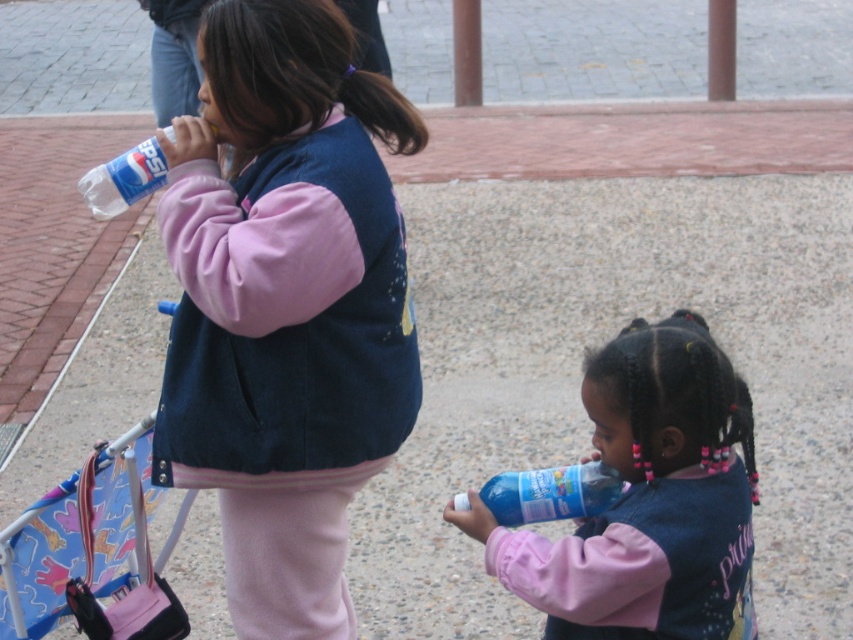
Question: Is blue translucent bottle at lower center above white plastic bottle at upper left?

Choices:
 (A) no
 (B) yes

Answer: (A)

Question: Among these objects, which one is farthest from the camera?

Choices:
 (A) multicolored fabric baby carriage at left
 (B) matte blue vest at center

Answer: (A)

Question: Considering the real-world distances, which object is farthest from the blue translucent bottle at lower center?

Choices:
 (A) matte blue vest at center
 (B) blue plastic bottle at center

Answer: (A)

Question: Among these points, which one is farthest from the camera?

Choices:
 (A) (114, 205)
 (B) (537, 509)
 (C) (111, 566)
 (D) (218, 86)

Answer: (C)

Question: Is multicolored fabric baby carriage at left bigger than white plastic bottle at upper left?

Choices:
 (A) yes
 (B) no

Answer: (A)

Question: Is multicolored fabric baby carriage at left further to camera compared to white plastic bottle at upper left?

Choices:
 (A) yes
 (B) no

Answer: (A)